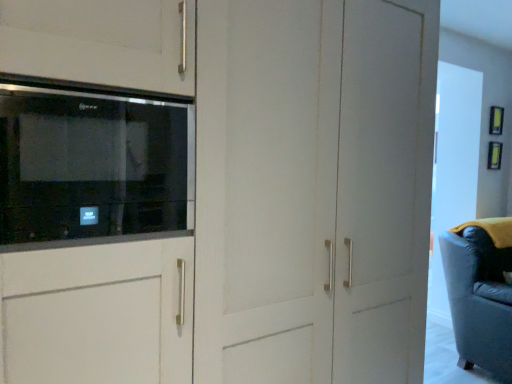
Question: Based on their sizes in the image, would you say black glass microwave at upper left is bigger or smaller than leather swivel chair at right?

Choices:
 (A) big
 (B) small

Answer: (B)

Question: From the image's perspective, is black glass microwave at upper left positioned above or below leather swivel chair at right?

Choices:
 (A) below
 (B) above

Answer: (B)

Question: Is black glass microwave at upper left spatially inside leather swivel chair at right, or outside of it?

Choices:
 (A) outside
 (B) inside

Answer: (A)

Question: Is point (482, 294) closer or farther from the camera than point (9, 117)?

Choices:
 (A) farther
 (B) closer

Answer: (A)

Question: From a real-world perspective, is leather swivel chair at right positioned above or below black glass microwave at upper left?

Choices:
 (A) above
 (B) below

Answer: (B)

Question: In the image, is leather swivel chair at right positioned in front of or behind black glass microwave at upper left?

Choices:
 (A) behind
 (B) front

Answer: (A)

Question: In terms of width, does leather swivel chair at right look wider or thinner when compared to black glass microwave at upper left?

Choices:
 (A) wide
 (B) thin

Answer: (A)